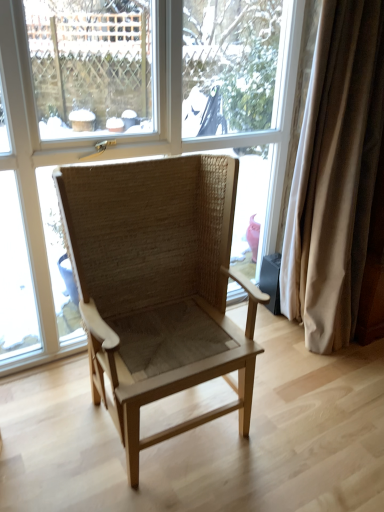
What are the coordinates of `vacant space that is to the left of natural woven chair at center` in the screenshot? It's located at (46, 419).